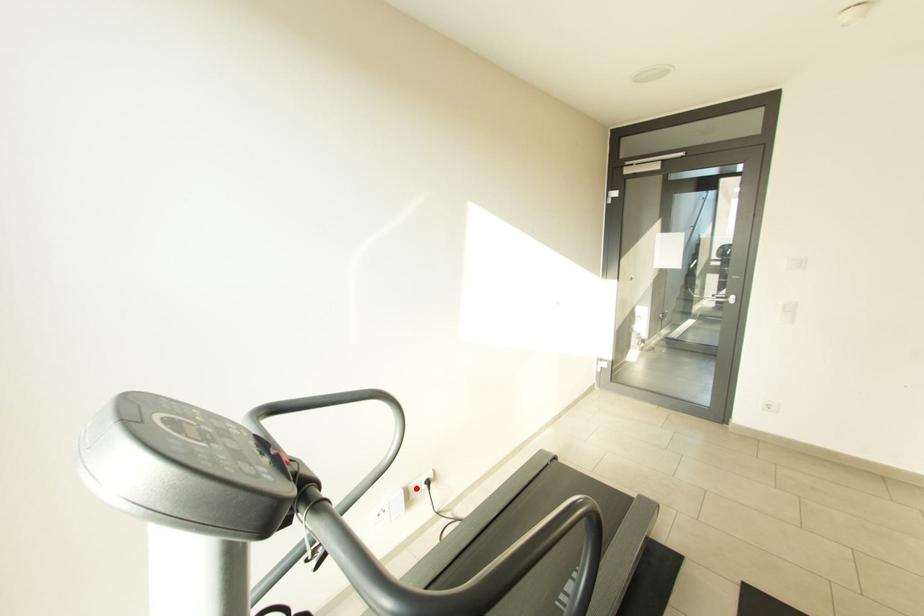
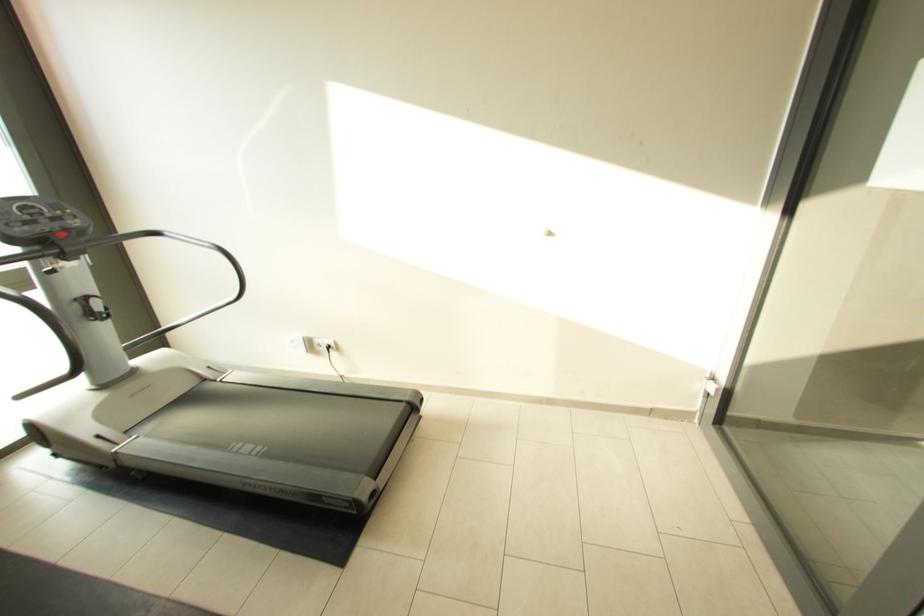
Question: I am providing you with two images of the same scene from different viewpoints. A red point is shown in image1. For the corresponding object point in image2, is it positioned nearer or farther from the camera?

Choices:
 (A) Nearer
 (B) Farther

Answer: (A)